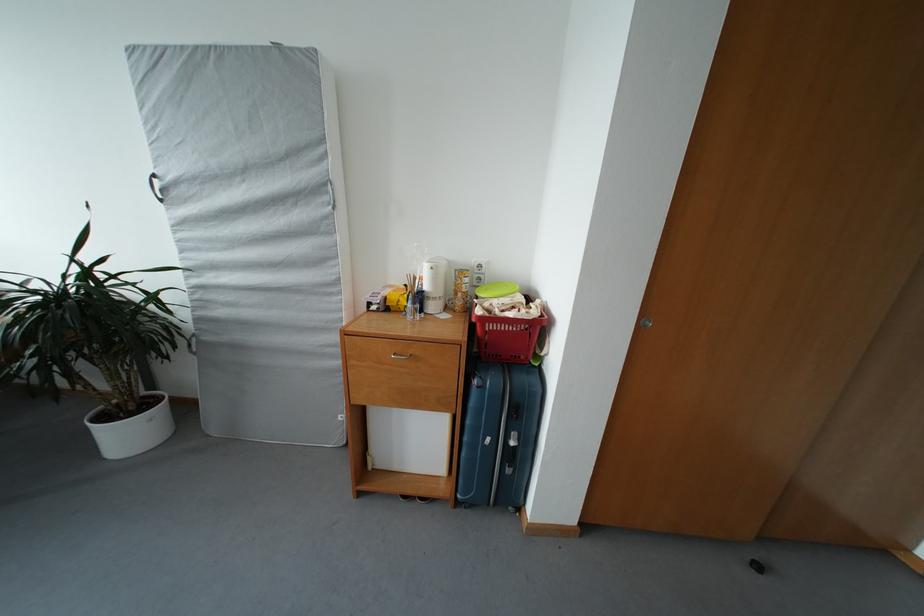
Where would you lift the red basket handle? Please return your answer as a coordinate pair (x, y).

(542, 344)